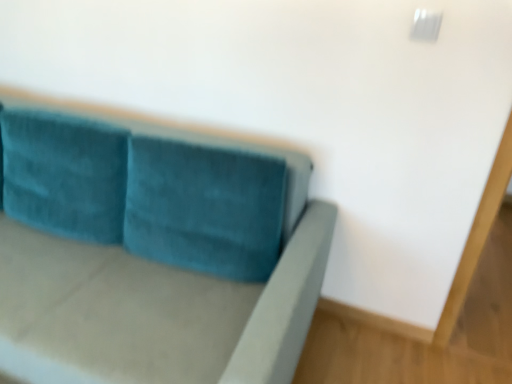
Identify the location of velvet teal couch at upper left. (158, 297).

What do you see at coordinates (158, 297) in the screenshot? I see `velvet teal couch at upper left` at bounding box center [158, 297].

You are a GUI agent. You are given a task and a screenshot of the screen. Output one action in this format:
    pyautogui.click(x=<x>, y=<y>)
    Task: Click on the velvet teal couch at upper left
    
    Given the screenshot: What is the action you would take?
    pyautogui.click(x=158, y=297)